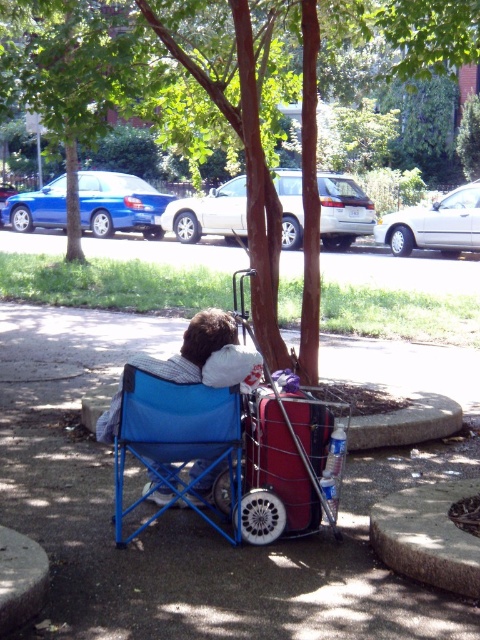
Question: Which object is farther from the camera taking this photo?

Choices:
 (A) blue fabric chair at center
 (B) green leafy tree at center

Answer: (B)

Question: Which object appears farthest from the camera in this image?

Choices:
 (A) green leafy tree at center
 (B) blue fabric chair at center

Answer: (A)

Question: Can you confirm if green leafy tree at center is smaller than blue fabric chair at center?

Choices:
 (A) yes
 (B) no

Answer: (B)

Question: Can you confirm if green leafy tree at center is wider than blue fabric chair at center?

Choices:
 (A) yes
 (B) no

Answer: (A)

Question: Can you confirm if green leafy tree at center is thinner than blue fabric chair at center?

Choices:
 (A) no
 (B) yes

Answer: (A)